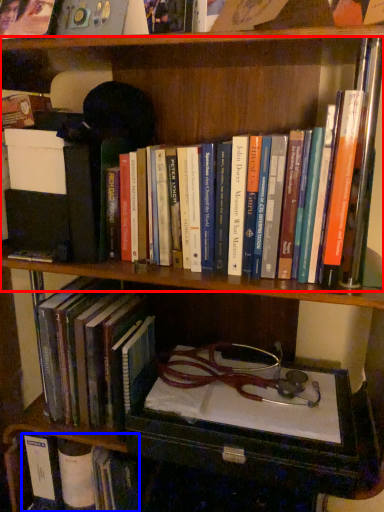
Question: Which point is further to the camera, book (highlighted by a red box) or book (highlighted by a blue box)?

Choices:
 (A) book
 (B) book

Answer: (B)